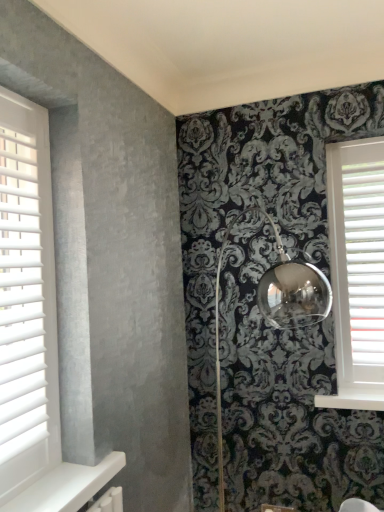
Where is `white painted wood at lower right`? white painted wood at lower right is located at coordinates (353, 400).

The width and height of the screenshot is (384, 512). I want to click on white plastic blinds at right, so click(365, 258).

Is white wood blinds at left surrounding white plastic blinds at right?

No.

Is there a large distance between white wood blinds at left and white plastic blinds at right?

Yes, white wood blinds at left and white plastic blinds at right are located far from each other.

Can you confirm if white wood blinds at left is positioned to the left of white plastic blinds at right?

Yes, white wood blinds at left is to the left of white plastic blinds at right.

Would you say white wood blinds at left is to the left or to the right of white painted wood at lower right in the picture?

In the image, white wood blinds at left appears on the left side of white painted wood at lower right.

Is white wood blinds at left aimed at white painted wood at lower right?

No, white wood blinds at left is not oriented towards white painted wood at lower right.

Based on the photo, in terms of width, does white wood blinds at left look wider or thinner when compared to white painted wood at lower right?

In the image, white wood blinds at left appears to be more narrow than white painted wood at lower right.

Does white wood blinds at left have a larger size compared to white painted wood at lower right?

Indeed, white wood blinds at left has a larger size compared to white painted wood at lower right.

Is white plastic blinds at right to the left of white wood blinds at left from the viewer's perspective?

In fact, white plastic blinds at right is to the right of white wood blinds at left.

Who is smaller, white plastic blinds at right or white wood blinds at left?

white plastic blinds at right.

From a real-world perspective, who is located lower, white plastic blinds at right or white wood blinds at left?

From a 3D spatial view, white plastic blinds at right is below.

In the scene shown: Is white painted wood at lower right not within white plastic blinds at right?

white painted wood at lower right is positioned outside white plastic blinds at right.

From a real-world perspective, is white painted wood at lower right beneath white plastic blinds at right?

Correct, in the physical world, white painted wood at lower right is lower than white plastic blinds at right.

From the image's perspective, is white painted wood at lower right above or below white plastic blinds at right?

Clearly, from the image's perspective, white painted wood at lower right is below white plastic blinds at right.

Is white plastic blinds at right outside of white painted wood at lower right?

Yes, white plastic blinds at right is not within white painted wood at lower right.

Based on the photo, which is less distant, (354, 204) or (381, 397)?

The point (381, 397) is closer.

From the image's perspective, is white plastic blinds at right positioned above or below white painted wood at lower right?

white plastic blinds at right is situated higher than white painted wood at lower right in the image.

Is white plastic blinds at right positioned with its back to white painted wood at lower right?

No.

Does white painted wood at lower right contain white wood blinds at left?

No, white painted wood at lower right does not contain white wood blinds at left.

From a real-world perspective, who is located higher, white painted wood at lower right or white wood blinds at left?

white wood blinds at left.

Where is `window sill behind the white wood blinds at left`? The image size is (384, 512). window sill behind the white wood blinds at left is located at coordinates (353, 400).

Considering the points (326, 402) and (26, 423), which point is behind, point (326, 402) or point (26, 423)?

The point (326, 402) is more distant.

At what (x,y) coordinates should I click in order to perform the action: click on window below the white plastic blinds at right (from the image's perspective). Please return your answer as a coordinate pair (x, y). Looking at the image, I should click on (26, 300).

This screenshot has height=512, width=384. I want to click on window sill that appears behind the white wood blinds at left, so click(353, 400).

Based on their spatial positions, is white wood blinds at left or white plastic blinds at right further from white painted wood at lower right?

The object further to white painted wood at lower right is white wood blinds at left.

Which object lies further to the anchor point white plastic blinds at right, white painted wood at lower right or white wood blinds at left?

Based on the image, white wood blinds at left appears to be further to white plastic blinds at right.

Considering their positions, is white plastic blinds at right positioned further to white wood blinds at left than white painted wood at lower right?

white plastic blinds at right is further to white wood blinds at left.

From the image, which object appears to be farther from white plastic blinds at right, white wood blinds at left or white painted wood at lower right?

white wood blinds at left.

Estimate the real-world distances between objects in this image. Which object is closer to white painted wood at lower right, white plastic blinds at right or white wood blinds at left?

The object closer to white painted wood at lower right is white plastic blinds at right.

Based on their spatial positions, is white painted wood at lower right or white plastic blinds at right further from white wood blinds at left?

Among the two, white plastic blinds at right is located further to white wood blinds at left.

You are a GUI agent. You are given a task and a screenshot of the screen. Output one action in this format:
    pyautogui.click(x=<x>, y=<y>)
    Task: Click on the window sill between white wood blinds at left and white plastic blinds at right in the horizontal direction
    The height and width of the screenshot is (512, 384).
    Given the screenshot: What is the action you would take?
    pyautogui.click(x=353, y=400)